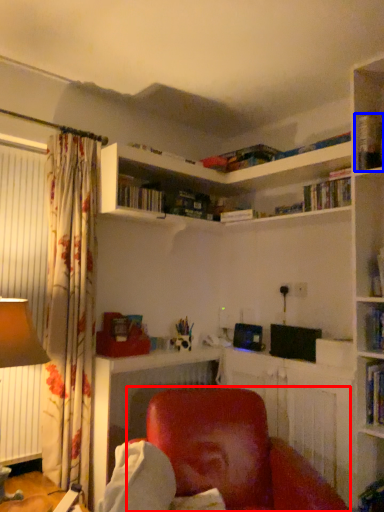
Question: Which point is further to the camera, chair (highlighted by a red box) or book (highlighted by a blue box)?

Choices:
 (A) chair
 (B) book

Answer: (B)